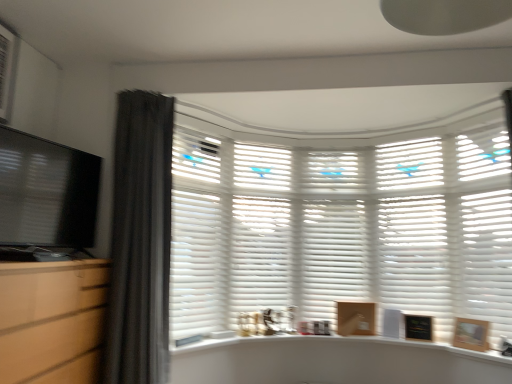
Question: From a real-world perspective, relative to wooden picture frame at lower right, the 2th picture frame from the back, is white matte shutter at right, the 5th shutter when ordered from left to right, vertically above or below?

Choices:
 (A) above
 (B) below

Answer: (A)

Question: Is white matte shutter at right, which is the first shutter in right-to-left order, in front of or behind wooden picture frame at lower right, the 2th picture frame from the back, in the image?

Choices:
 (A) behind
 (B) front

Answer: (B)

Question: Estimate the real-world distances between objects in this image. Which object is farther from the dark gray fabric curtain at left?

Choices:
 (A) black matte picture frame at lower right, acting as the 1th picture frame starting from the back
 (B) white plastic air conditioner at upper left
 (C) white matte shutter at right, which is the first shutter in right-to-left order
 (D) wooden picture frame at lower right, the 2th picture frame from the back
 (E) matte wood file cabinet at left

Answer: (C)

Question: Which of these objects is positioned farthest from the black matte picture frame at lower right, marked as the 1th picture frame in a left-to-right arrangement?

Choices:
 (A) white matte shutter at right, which is the first shutter in right-to-left order
 (B) white matte shutter at center, which ranks as the 5th shutter in right-to-left order
 (C) matte black monitor at left
 (D) white matte counter top at center
 (E) wooden picture frame at lower right, which ranks as the 1th picture frame in right-to-left order

Answer: (C)